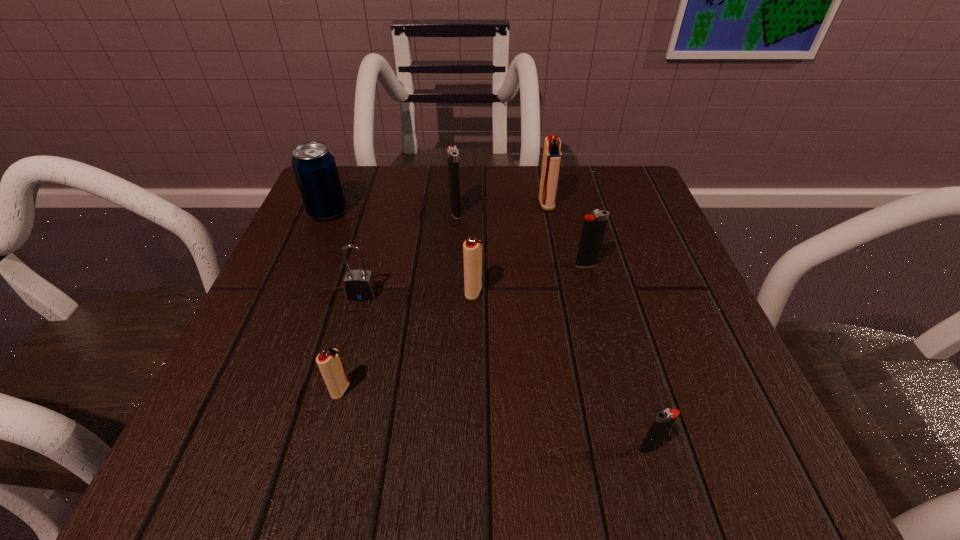
Identify the location of vacant region located on the back of the nearest red igniter. pos(353,341).

Locate an element on the screen. The width and height of the screenshot is (960, 540). vacant space situated 0.300m on the back of the smallest black igniter is located at coordinates (601, 279).

At what (x,y) coordinates should I click in order to perform the action: click on soda can present at the far edge. Please return your answer as a coordinate pair (x, y). Looking at the image, I should click on (314, 166).

You are a GUI agent. You are given a task and a screenshot of the screen. Output one action in this format:
    pyautogui.click(x=<x>, y=<y>)
    Task: Click on the object at the near edge
    
    Given the screenshot: What is the action you would take?
    pyautogui.click(x=664, y=420)

Identify the location of soda can that is at the left edge. (314, 166).

Where is `padlock that is positioned at the left edge`? This screenshot has width=960, height=540. padlock that is positioned at the left edge is located at coordinates (359, 285).

Find the location of `igniter that is at the left edge`. igniter that is at the left edge is located at coordinates (329, 362).

Find the location of `object at the far left corner`. object at the far left corner is located at coordinates (314, 166).

The width and height of the screenshot is (960, 540). I want to click on object at the near right corner, so click(664, 420).

Where is `free space at the far edge`? free space at the far edge is located at coordinates (486, 212).